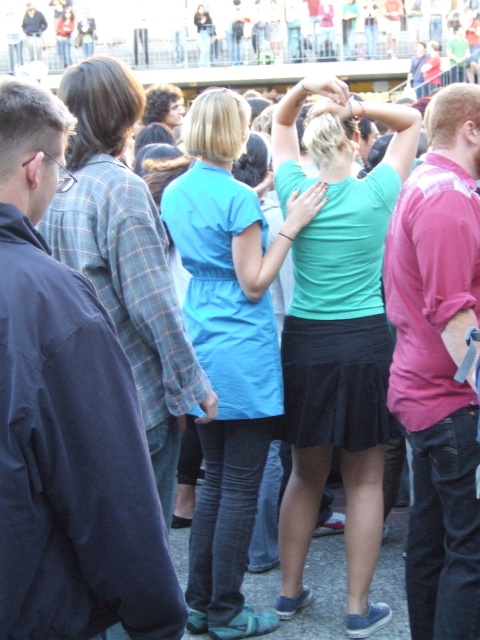
Question: In this image, where is matte green shirt at center located relative to matte blue dress at center?

Choices:
 (A) left
 (B) right

Answer: (B)

Question: In this image, where is matte green shirt at center located relative to pink cotton shirt at right?

Choices:
 (A) left
 (B) right

Answer: (A)

Question: Does matte blue dress at center have a smaller size compared to pink cotton shirt at right?

Choices:
 (A) no
 (B) yes

Answer: (A)

Question: Estimate the real-world distances between objects in this image. Which object is closer to the matte green shirt at center?

Choices:
 (A) pink cotton shirt at right
 (B) matte blue dress at center

Answer: (B)

Question: Which point appears closest to the camera in this image?

Choices:
 (A) (218, 628)
 (B) (417, 461)
 (C) (350, 320)

Answer: (B)

Question: Which object appears closest to the camera in this image?

Choices:
 (A) matte blue dress at center
 (B) matte green shirt at center
 (C) pink cotton shirt at right

Answer: (C)